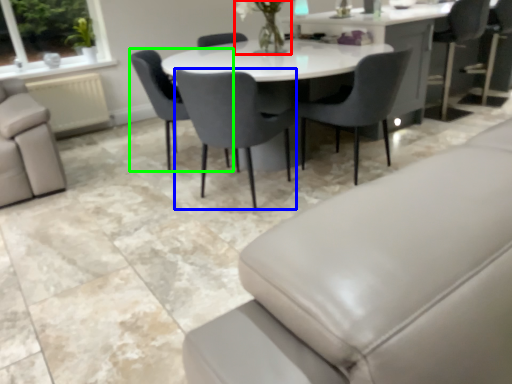
Question: Which object is the farthest from floral arrangement (highlighted by a red box)? Choose among these: chair (highlighted by a blue box) or chair (highlighted by a green box).

Choices:
 (A) chair
 (B) chair

Answer: (A)